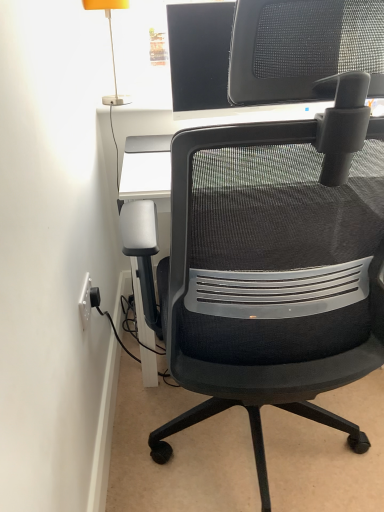
Question: From a real-world perspective, is orange fabric lampshade at upper left positioned above or below black mesh office chair at center?

Choices:
 (A) below
 (B) above

Answer: (B)

Question: Is orange fabric lampshade at upper left wider or thinner than black mesh office chair at center?

Choices:
 (A) wide
 (B) thin

Answer: (B)

Question: Considering the positions of orange fabric lampshade at upper left and black mesh office chair at center in the image, is orange fabric lampshade at upper left bigger or smaller than black mesh office chair at center?

Choices:
 (A) small
 (B) big

Answer: (A)

Question: Considering the positions of black mesh office chair at center and orange fabric lampshade at upper left in the image, is black mesh office chair at center bigger or smaller than orange fabric lampshade at upper left?

Choices:
 (A) small
 (B) big

Answer: (B)

Question: Considering the positions of point (243, 145) and point (104, 8), is point (243, 145) closer or farther from the camera than point (104, 8)?

Choices:
 (A) closer
 (B) farther

Answer: (A)

Question: Relative to orange fabric lampshade at upper left, is black mesh office chair at center in front or behind?

Choices:
 (A) behind
 (B) front

Answer: (B)

Question: Is black mesh office chair at center inside the boundaries of orange fabric lampshade at upper left, or outside?

Choices:
 (A) outside
 (B) inside

Answer: (A)